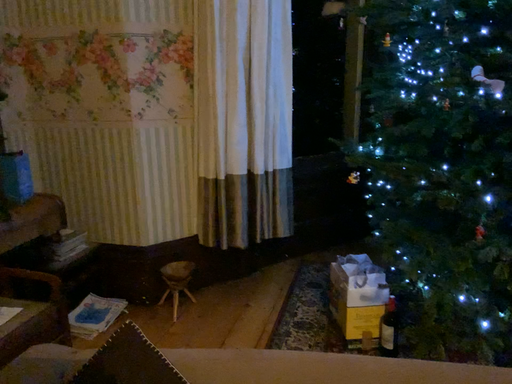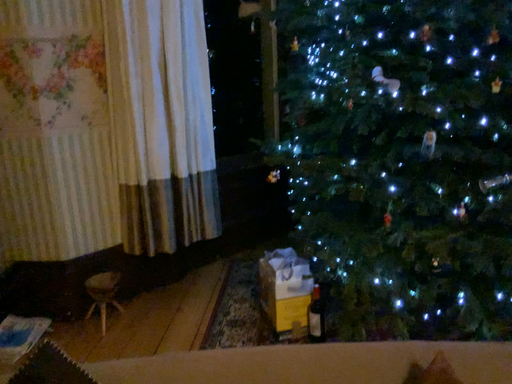
Question: Which way did the camera rotate in the video?

Choices:
 (A) rotated left
 (B) rotated right

Answer: (B)